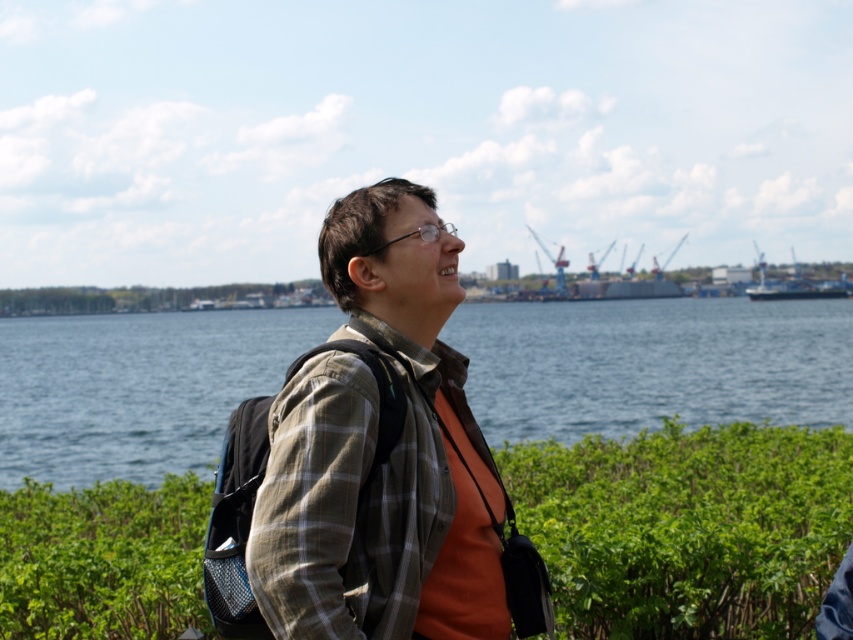
You are a photographer wanting to capture the blue metallic ship at right in your shot. However, you notice the green leafy shrubs at center might block the view. Based on the scene description, can you determine if the shrubs are in front of or behind the ship?

The green leafy shrubs at center are in front of the blue metallic ship at right, so they will block the view of the ship.

You are a photographer planning to take a wide shot of the blue metallic ship at right and the green leafy shrubs at center. Which object should you focus on first if you want to ensure both are in sharp focus, considering their sizes?

The green leafy shrubs at center is smaller than the blue metallic ship at right, so you should focus on the blue metallic ship at right first to ensure both are in sharp focus.